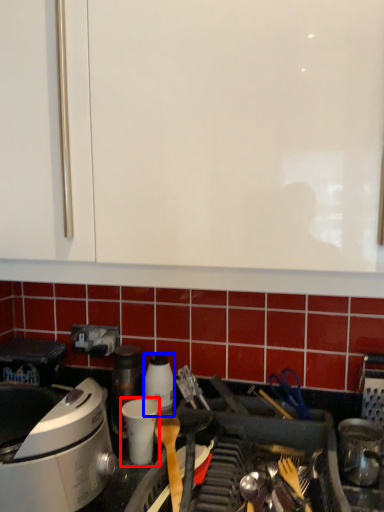
Question: Which object appears farthest to the camera in this image, appliance (highlighted by a red box) or kitchen appliance (highlighted by a blue box)?

Choices:
 (A) appliance
 (B) kitchen appliance

Answer: (B)